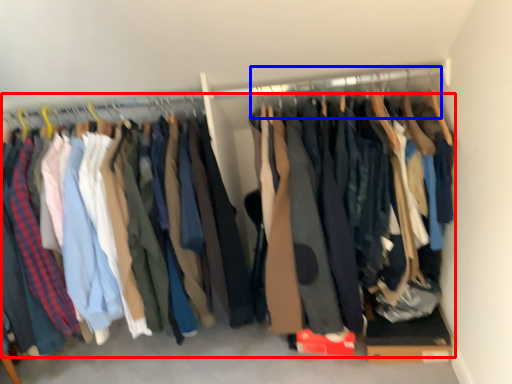
Question: Which of the following is the closest to the observer, trousers (highlighted by a red box) or hanger (highlighted by a blue box)?

Choices:
 (A) trousers
 (B) hanger

Answer: (A)